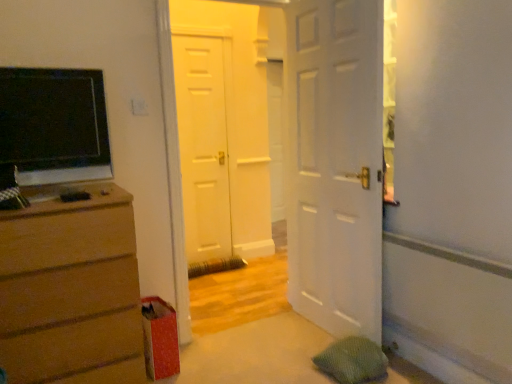
What are the coordinates of `vacant region under white matte door at center, the 2th door from the front (from a real-world perspective)` in the screenshot? It's located at (246, 323).